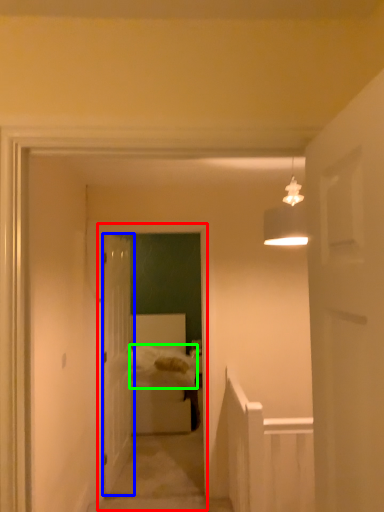
Question: Which object is positioned farthest from corridor (highlighted by a red box)? Select from door (highlighted by a blue box) and sheet (highlighted by a green box).

Choices:
 (A) door
 (B) sheet

Answer: (B)